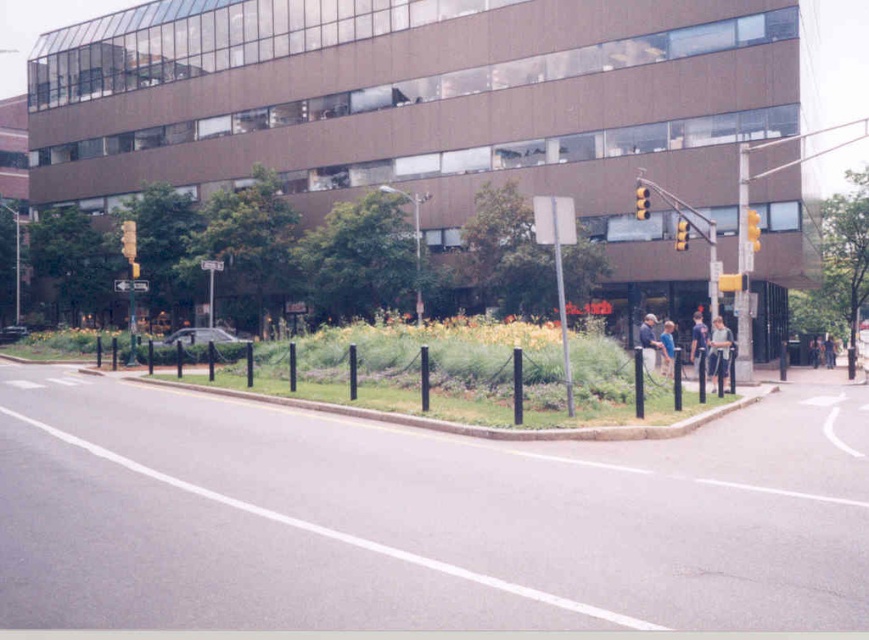
Does point (660, 342) come in front of point (701, 336)?

Yes, it is.

Image resolution: width=869 pixels, height=640 pixels. Describe the element at coordinates (648, 340) in the screenshot. I see `light brown leather jacket at center` at that location.

Where is `light brown leather jacket at center`? The height and width of the screenshot is (640, 869). light brown leather jacket at center is located at coordinates (648, 340).

The height and width of the screenshot is (640, 869). Identify the location of light brown leather jacket at center. (648, 340).

Who is positioned more to the right, dark blue jeans at center or yellow matte traffic light at upper right?

From the viewer's perspective, yellow matte traffic light at upper right appears more on the right side.

Is the position of dark blue jeans at center more distant than that of yellow matte traffic light at upper right?

No, dark blue jeans at center is closer to the viewer.

Where is `dark blue jeans at center`? The image size is (869, 640). dark blue jeans at center is located at coordinates (697, 339).

Who is more forward, (562, 515) or (750, 241)?

Point (562, 515) is in front.

Which of these two, black asphalt road at center or yellow matte traffic light at upper right, stands taller?

yellow matte traffic light at upper right is taller.

Is point (586, 458) positioned after point (755, 236)?

No, (586, 458) is closer to viewer.

The width and height of the screenshot is (869, 640). I want to click on black asphalt road at center, so 419,518.